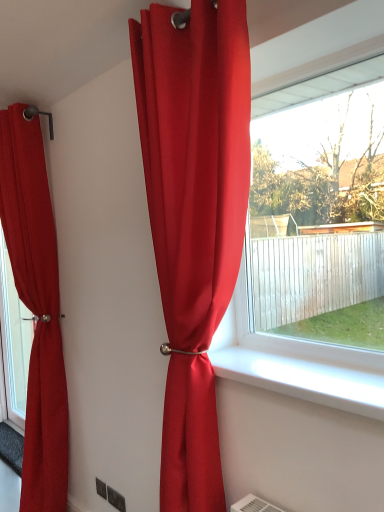
Question: From their relative heights in the image, would you say white smooth window sill at center is taller or shorter than matte red curtain at left, the 1th curtain from the back?

Choices:
 (A) short
 (B) tall

Answer: (A)

Question: Considering the positions of white smooth window sill at center and matte red curtain at left, which is counted as the second curtain, starting from the front, in the image, is white smooth window sill at center bigger or smaller than matte red curtain at left, which is counted as the second curtain, starting from the front,?

Choices:
 (A) small
 (B) big

Answer: (A)

Question: Which object is positioned closest to the matte red curtain at center, placed as the first curtain when sorted from front to back?

Choices:
 (A) white smooth window sill at center
 (B) matte red curtain at left, marked as the second curtain in a right-to-left arrangement

Answer: (A)

Question: Considering the real-world distances, which object is closest to the white smooth window sill at center?

Choices:
 (A) matte red curtain at center, marked as the second curtain in a back-to-front arrangement
 (B) matte red curtain at left, marked as the second curtain in a right-to-left arrangement

Answer: (A)